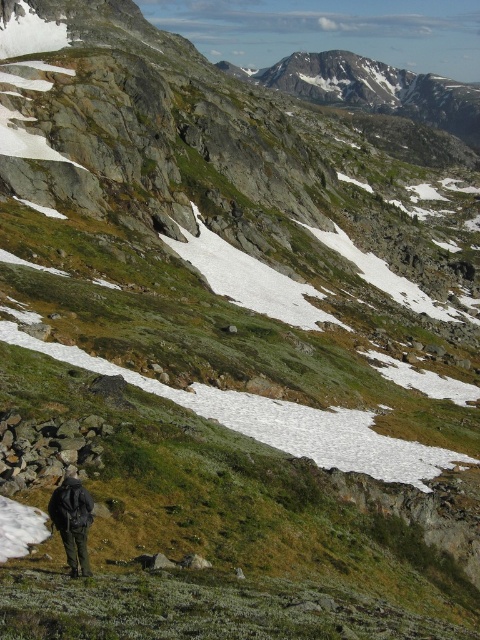
You are a hiker trying to reach the rusty metallic rocks at lower left from your current position near the dark green jacket at lower left. Given that you can walk 2 meters per second, how long will it take you to reach them?

The distance between the rusty metallic rocks at lower left and the dark green jacket at lower left is 6.27 meters. At a walking speed of 2 meters per second, it would take approximately 3.14 seconds to reach the rusty metallic rocks at lower left.

You are a hiker who wants to place a small first aid kit on the ground near the dark green jacket at lower left. However, you need to ensure there is enough space between the rusty metallic rocks at lower left and the jacket to avoid blocking the kit. Can you determine if there is sufficient space between them?

The rusty metallic rocks at lower left is positioned on the left side of dark green jacket at lower left, but the exact distance between them is not specified. Without knowing the distance, it is unclear if there is enough space to place the first aid kit without obstruction.

You are a hiker planning to set up a tent in the area. You need to choose between placing it on the rusty metallic rocks at lower left or the dark green jacket at lower left. Which location offers more space for the tent?

The dark green jacket at lower left offers more space for the tent since the rusty metallic rocks at lower left has a lesser width compared to dark green jacket at lower left.